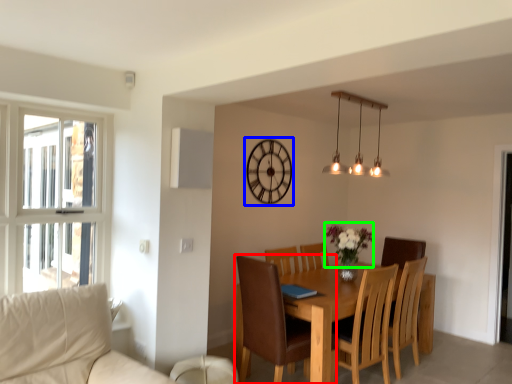
Question: Considering the real-world distances, which object is farthest from chair (highlighted by a red box)? clock (highlighted by a blue box) or flower (highlighted by a green box)?

Choices:
 (A) clock
 (B) flower

Answer: (A)